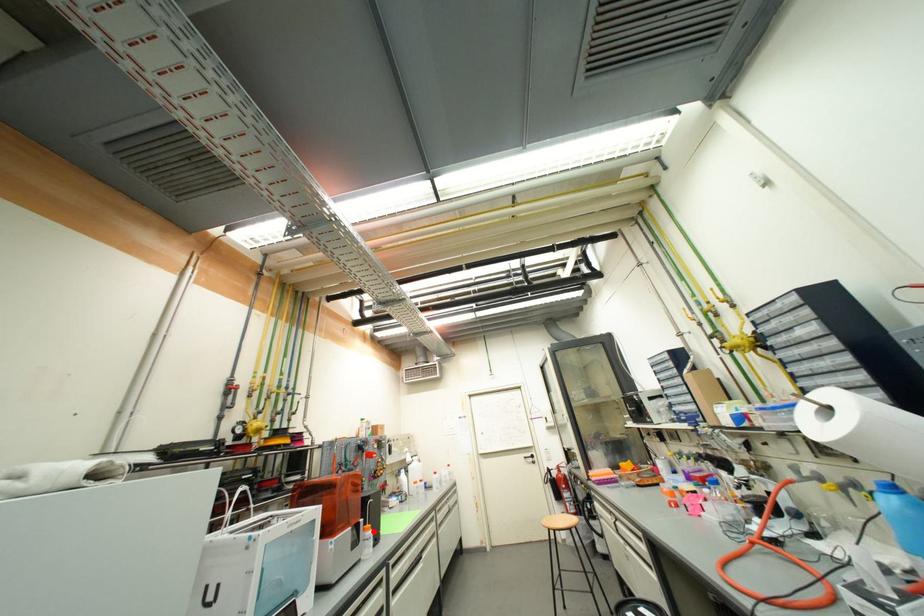
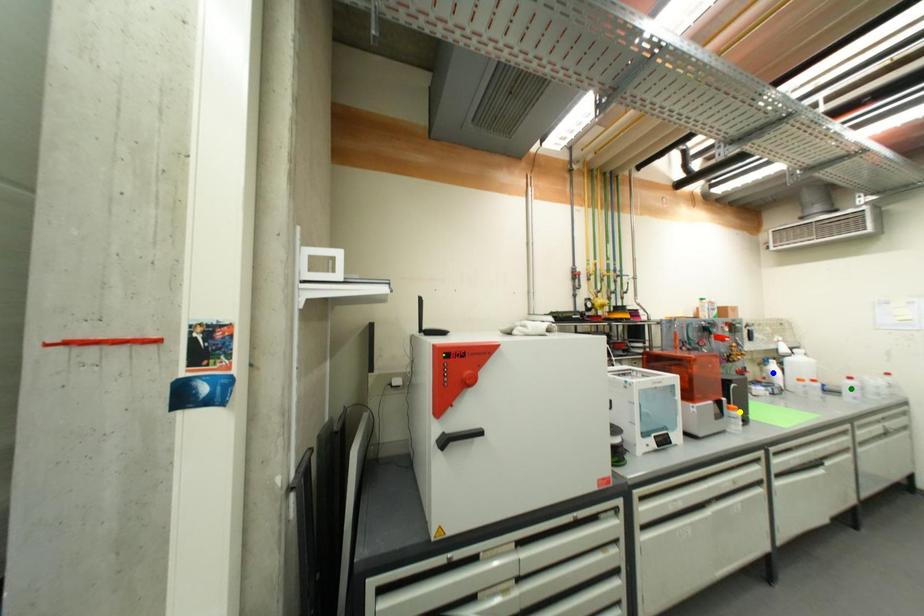
Question: I am providing you with two images of the same scene from different viewpoints. A red point is marked on the first image. You are given multiple points on the second image. Which spot in image 2 lines up with the point in image 1?

Choices:
 (A) green point
 (B) yellow point
 (C) blue point

Answer: (B)